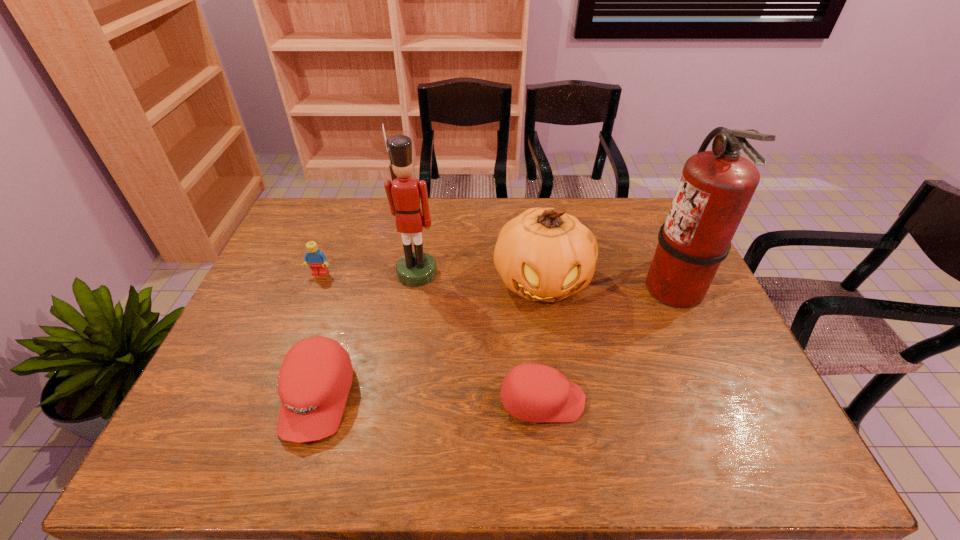
In the image, there is a desktop. At what (x,y) coordinates should I click in order to perform the action: click on vacant space at the far left corner. Please return your answer as a coordinate pair (x, y). The height and width of the screenshot is (540, 960). Looking at the image, I should click on (325, 228).

Find the location of a particular element. The image size is (960, 540). vacant space at the far right corner of the desktop is located at coordinates pos(644,235).

At what (x,y) coordinates should I click in order to perform the action: click on vacant space that's between the right cap and the third object from left to right. Please return your answer as a coordinate pair (x, y). The width and height of the screenshot is (960, 540). Looking at the image, I should click on (479, 337).

Find the location of a particular element. This screenshot has height=540, width=960. blank region between the shorter cap and the nutcracker is located at coordinates (479, 337).

Find the location of a particular element. Image resolution: width=960 pixels, height=540 pixels. free space between the shortest object and the pumpkin is located at coordinates (542, 341).

Find the location of a particular element. free point between the nutcracker and the right cap is located at coordinates (479, 337).

Identify the location of free spot between the third tallest object and the rightmost object. (608, 284).

This screenshot has height=540, width=960. Identify the location of free space between the left cap and the right cap. (430, 400).

Identify the location of free space between the nutcracker and the Lego. (369, 273).

The image size is (960, 540). I want to click on vacant space that is in between the fire extinguisher and the fourth shortest object, so click(608, 284).